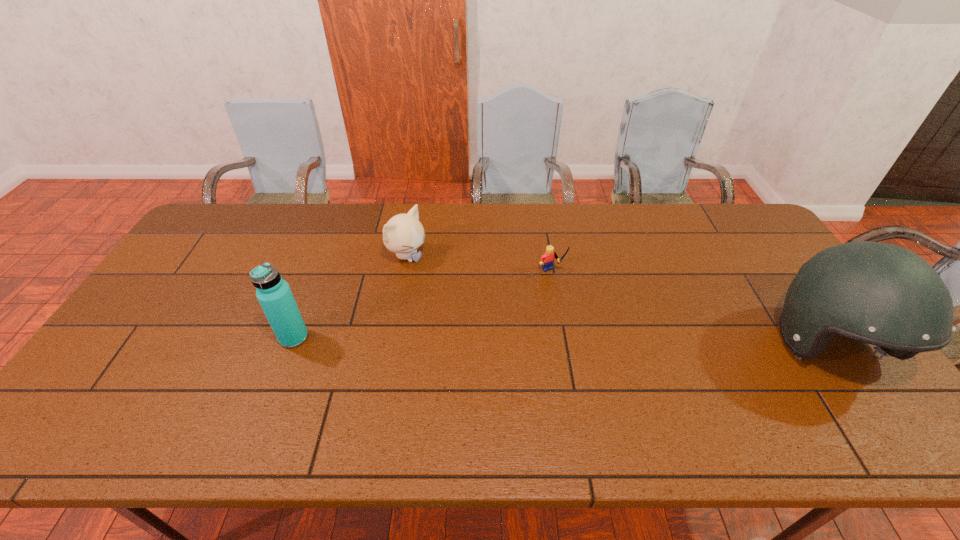
Find the location of a particular element. The width and height of the screenshot is (960, 540). vacant space located 0.240m on the front-facing side of the Lego is located at coordinates [604, 335].

Locate an element on the screen. The height and width of the screenshot is (540, 960). free region located on the front-facing side of the Lego is located at coordinates (637, 376).

You are a GUI agent. You are given a task and a screenshot of the screen. Output one action in this format:
    pyautogui.click(x=<x>, y=<y>)
    Task: Click on the free space located 0.170m on the face of the kitten
    The image size is (960, 540).
    Given the screenshot: What is the action you would take?
    pyautogui.click(x=464, y=288)

Where is `free space located on the face of the kitten`? Image resolution: width=960 pixels, height=540 pixels. free space located on the face of the kitten is located at coordinates (508, 313).

You are a GUI agent. You are given a task and a screenshot of the screen. Output one action in this format:
    pyautogui.click(x=<x>, y=<y>)
    Task: Click on the free space located 0.220m on the face of the kitten
    Image resolution: width=960 pixels, height=540 pixels.
    Given the screenshot: What is the action you would take?
    pyautogui.click(x=477, y=296)

Locate an element on the screen. The height and width of the screenshot is (540, 960). object that is at the far edge is located at coordinates (403, 234).

Identify the location of object located at the near edge. (881, 294).

The image size is (960, 540). I want to click on object positioned at the right edge, so click(881, 294).

At what (x,y) coordinates should I click in order to perform the action: click on object that is at the near right corner. Please return your answer as a coordinate pair (x, y). Image resolution: width=960 pixels, height=540 pixels. Looking at the image, I should click on (881, 294).

At what (x,y) coordinates should I click in order to perform the action: click on vacant space at the far edge of the desktop. Please return your answer as a coordinate pair (x, y). Looking at the image, I should click on (365, 217).